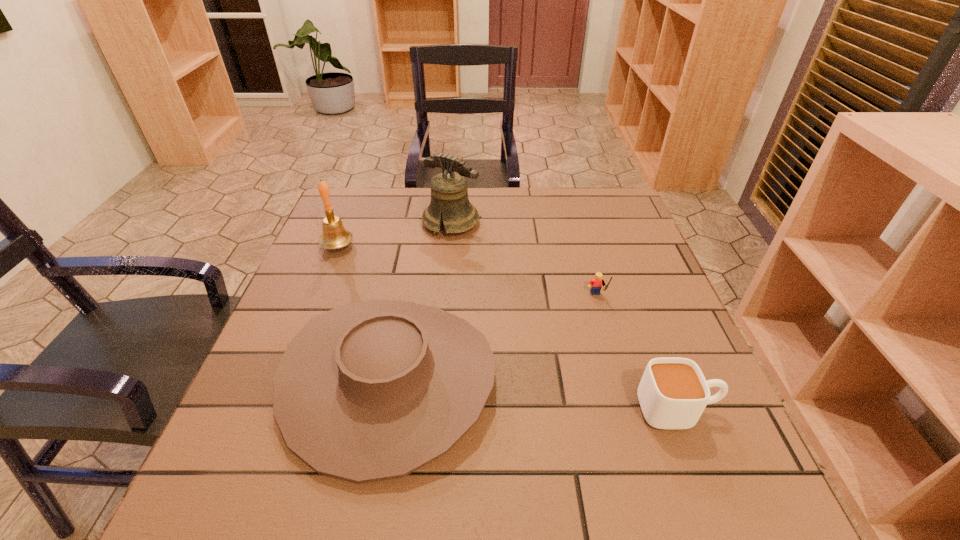
The width and height of the screenshot is (960, 540). Find the location of `the right bell`. the right bell is located at coordinates (449, 194).

Locate an element on the screen. the left bell is located at coordinates (334, 236).

Locate an element on the screen. The height and width of the screenshot is (540, 960). cowboy hat is located at coordinates (373, 390).

Where is `cup`? cup is located at coordinates (673, 392).

In order to click on Lego in this screenshot , I will do `click(595, 284)`.

You are a GUI agent. You are given a task and a screenshot of the screen. Output one action in this format:
    pyautogui.click(x=<x>, y=<y>)
    Task: Click on the vacant area located 0.360m on the right of the right bell
    The image size is (960, 540).
    Given the screenshot: What is the action you would take?
    pyautogui.click(x=607, y=222)

Image resolution: width=960 pixels, height=540 pixels. Identify the location of free space located 0.160m on the right of the left bell. (414, 246).

Where is `free region located on the right of the cowboy hat`? This screenshot has height=540, width=960. free region located on the right of the cowboy hat is located at coordinates click(695, 380).

The image size is (960, 540). In order to click on vacant position located 0.330m on the front-facing side of the Lego in this screenshot , I will do `click(637, 438)`.

You are a GUI agent. You are given a task and a screenshot of the screen. Output one action in this format:
    pyautogui.click(x=<x>, y=<y>)
    Task: Click on the object located in the far edge section of the desktop
    The height and width of the screenshot is (540, 960).
    Given the screenshot: What is the action you would take?
    pyautogui.click(x=449, y=194)